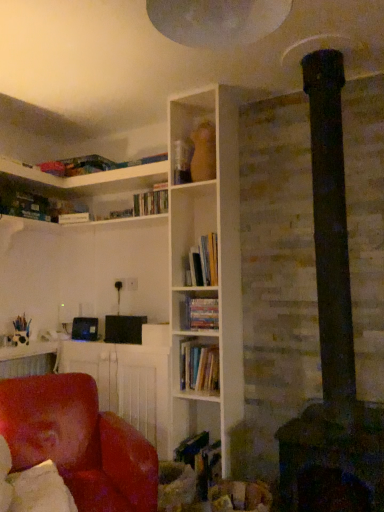
This screenshot has width=384, height=512. I want to click on hardcover books at center, the second book ordered from the bottom, so click(199, 313).

Is hardcover books at center, acting as the first book starting from the top, facing away from hardcover books at center, the third book when ordered from top to bottom?

No, hardcover books at center, acting as the first book starting from the top,'s orientation is not away from hardcover books at center, the third book when ordered from top to bottom.

Can you confirm if hardcover books at center, acting as the first book starting from the top, is positioned to the right of hardcover books at center, the first book in the bottom-to-top sequence?

No.

From the image's perspective, is hardcover books at center, the third book from the bottom, below hardcover books at center, the first book in the bottom-to-top sequence?

No, from the image's perspective, hardcover books at center, the third book from the bottom, is not below hardcover books at center, the first book in the bottom-to-top sequence.

Is hardcover books at center, the third book from the bottom, not inside hardcover books at center, the first book in the bottom-to-top sequence?

hardcover books at center, the third book from the bottom, is positioned outside hardcover books at center, the first book in the bottom-to-top sequence.

Considering the positions of point (137, 408) and point (203, 271), is point (137, 408) closer or farther from the camera than point (203, 271)?

Point (137, 408) is farther from the camera than point (203, 271).

Is the position of matte red chair at lower left more distant than that of hardcover books at center, the third book from the bottom?

No, it is not.

Image resolution: width=384 pixels, height=512 pixels. Find the location of `table on the left of hardcover books at center, the third book from the bottom`. table on the left of hardcover books at center, the third book from the bottom is located at coordinates (129, 381).

Is matte red chair at lower left located outside hardcover books at center, acting as the first book starting from the top?

Yes, matte red chair at lower left is not within hardcover books at center, acting as the first book starting from the top.

Is hardcover books at center, the third book when ordered from top to bottom, wider or thinner than hardcover books at center, which ranks as the second book in top-to-bottom order?

Considering their sizes, hardcover books at center, the third book when ordered from top to bottom, looks broader than hardcover books at center, which ranks as the second book in top-to-bottom order.

Is hardcover books at center, the first book in the bottom-to-top sequence, directly adjacent to hardcover books at center, which ranks as the second book in top-to-bottom order?

No, hardcover books at center, the first book in the bottom-to-top sequence, is not touching hardcover books at center, which ranks as the second book in top-to-bottom order.

Is hardcover books at center, the third book when ordered from top to bottom, spatially inside hardcover books at center, the third book from the bottom, or outside of it?

hardcover books at center, the third book when ordered from top to bottom, is not inside hardcover books at center, the third book from the bottom, it's outside.

From a real-world perspective, between hardcover books at center, the first book in the bottom-to-top sequence, and hardcover books at center, the third book from the bottom, who is vertically lower?

hardcover books at center, the first book in the bottom-to-top sequence, is physically lower.

Is hardcover books at center, the first book in the bottom-to-top sequence, taller or shorter than hardcover books at center, acting as the first book starting from the top?

In the image, hardcover books at center, the first book in the bottom-to-top sequence, appears to be shorter than hardcover books at center, acting as the first book starting from the top.

Can you see hardcover books at center, the third book when ordered from top to bottom, touching hardcover books at center, the third book from the bottom?

No, hardcover books at center, the third book when ordered from top to bottom, is not with hardcover books at center, the third book from the bottom.

Considering the points (26, 449) and (213, 250), which point is in front, point (26, 449) or point (213, 250)?

The point (26, 449) is in front.

Is leather at left directly adjacent to hardcover books at center, acting as the first book starting from the top?

No, leather at left is not with hardcover books at center, acting as the first book starting from the top.

Visually, is leather at left positioned to the left or to the right of hardcover books at center, the third book from the bottom?

Based on their positions, leather at left is located to the left of hardcover books at center, the third book from the bottom.

The image size is (384, 512). There is a leather at left. Find the location of `the 2nd book above it (from the image's perspective)`. the 2nd book above it (from the image's perspective) is located at coordinates (199, 313).

Measure the distance from leather at left to hardcover books at center, which ranks as the second book in top-to-bottom order.

They are 81.30 centimeters apart.

Which is in front, leather at left or hardcover books at center, which ranks as the second book in top-to-bottom order?

leather at left.

Who is smaller, leather at left or hardcover books at center, the second book ordered from the bottom?

With smaller size is hardcover books at center, the second book ordered from the bottom.

Would you say hardcover books at center, the second book ordered from the bottom, contains leather at left?

That's incorrect, leather at left is not inside hardcover books at center, the second book ordered from the bottom.

Which is behind, point (210, 306) or point (27, 450)?

Positioned behind is point (210, 306).

Locate an element on the screen. The image size is (384, 512). chair to the left of hardcover books at center, which ranks as the second book in top-to-bottom order is located at coordinates (79, 442).

From a real-world perspective, who is located lower, hardcover books at center, the second book ordered from the bottom, or leather at left?

leather at left, from a real-world perspective.

This screenshot has height=512, width=384. Identify the location of the 1st book to the left of the hardcover books at center, the third book when ordered from top to bottom, counting from the anchor's position. coord(203,262).

At what (x,y) coordinates should I click in order to perform the action: click on table located underneath the hardcover books at center, acting as the first book starting from the top (from a real-world perspective). Please return your answer as a coordinate pair (x, y). Looking at the image, I should click on pyautogui.click(x=129, y=381).

Which object lies nearer to the anchor point hardcover books at center, which ranks as the second book in top-to-bottom order, matte red chair at lower left or hardcover books at center, acting as the first book starting from the top?

hardcover books at center, acting as the first book starting from the top, lies closer to hardcover books at center, which ranks as the second book in top-to-bottom order, than the other object.

Looking at the image, which one is located further to hardcover books at center, the first book in the bottom-to-top sequence, hardcover books at center, the third book from the bottom, or matte red chair at lower left?

The object further to hardcover books at center, the first book in the bottom-to-top sequence, is hardcover books at center, the third book from the bottom.

Which object lies nearer to the anchor point matte red chair at lower left, hardcover books at center, acting as the first book starting from the top, or leather at left?

leather at left is closer to matte red chair at lower left.

Which object lies further to the anchor point hardcover books at center, acting as the first book starting from the top, matte red chair at lower left or hardcover books at center, the third book when ordered from top to bottom?

Among the two, matte red chair at lower left is located further to hardcover books at center, acting as the first book starting from the top.

Looking at the image, which one is located further to hardcover books at center, which ranks as the second book in top-to-bottom order, hardcover books at center, acting as the first book starting from the top, or matte red chair at lower left?

matte red chair at lower left is further to hardcover books at center, which ranks as the second book in top-to-bottom order.

Based on their spatial positions, is matte red chair at lower left or leather at left closer to hardcover books at center, the second book ordered from the bottom?

The object closer to hardcover books at center, the second book ordered from the bottom, is matte red chair at lower left.

Which object lies further to the anchor point hardcover books at center, acting as the first book starting from the top, leather at left or hardcover books at center, which ranks as the second book in top-to-bottom order?

leather at left lies further to hardcover books at center, acting as the first book starting from the top, than the other object.

Looking at the image, which one is located closer to hardcover books at center, the first book in the bottom-to-top sequence, leather at left or matte red chair at lower left?

Based on the image, matte red chair at lower left appears to be nearer to hardcover books at center, the first book in the bottom-to-top sequence.

Image resolution: width=384 pixels, height=512 pixels. Find the location of `table between leather at left and hardcover books at center, the third book when ordered from top to bottom, along the z-axis`. table between leather at left and hardcover books at center, the third book when ordered from top to bottom, along the z-axis is located at coordinates (129, 381).

Identify the location of table between hardcover books at center, acting as the first book starting from the top, and leather at left vertically. The image size is (384, 512). 129,381.

Identify the location of book between leather at left and hardcover books at center, the first book in the bottom-to-top sequence, from front to back. (203, 262).

At what (x,y) coordinates should I click in order to perform the action: click on book between hardcover books at center, which ranks as the second book in top-to-bottom order, and matte red chair at lower left, in the vertical direction. Please return your answer as a coordinate pair (x, y). The height and width of the screenshot is (512, 384). Looking at the image, I should click on tap(199, 367).